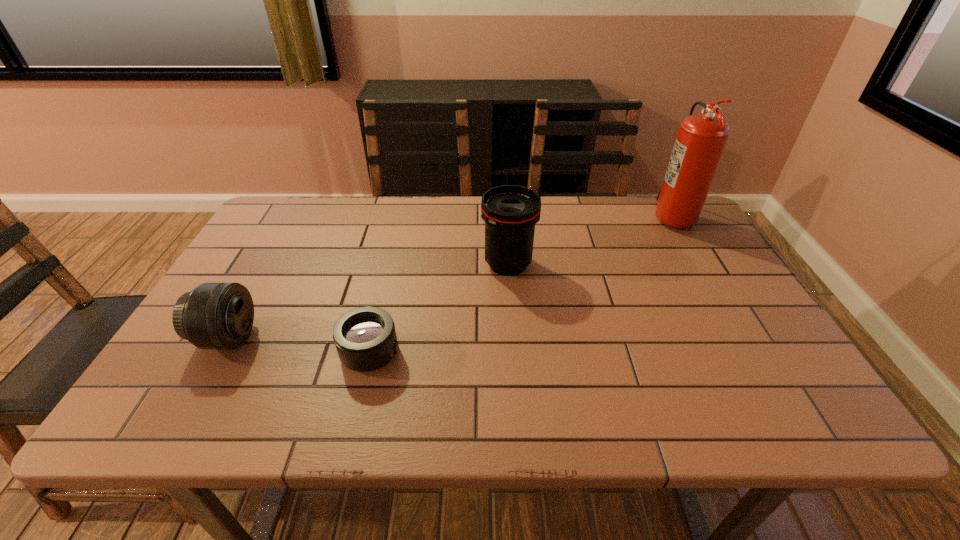
Image resolution: width=960 pixels, height=540 pixels. I want to click on fire extinguisher, so click(701, 139).

In order to click on the farthest object in this screenshot , I will do `click(701, 139)`.

Where is `the third object from left to right`? This screenshot has width=960, height=540. the third object from left to right is located at coordinates (510, 212).

Locate an element on the screen. the rightmost telephoto lens is located at coordinates (510, 212).

At what (x,y) coordinates should I click in order to perform the action: click on the second shortest object. Please return your answer as a coordinate pair (x, y). The width and height of the screenshot is (960, 540). Looking at the image, I should click on (x=220, y=315).

Where is `the leftmost object`? The image size is (960, 540). the leftmost object is located at coordinates (220, 315).

The image size is (960, 540). Identify the location of the second object from left to right. (365, 338).

Where is `the shortest object`? This screenshot has height=540, width=960. the shortest object is located at coordinates (365, 338).

What are the coordinates of `free point located on the instruction side of the rightmost object` in the screenshot? It's located at (581, 215).

I want to click on free space located 0.190m on the instruction side of the rightmost object, so click(x=590, y=215).